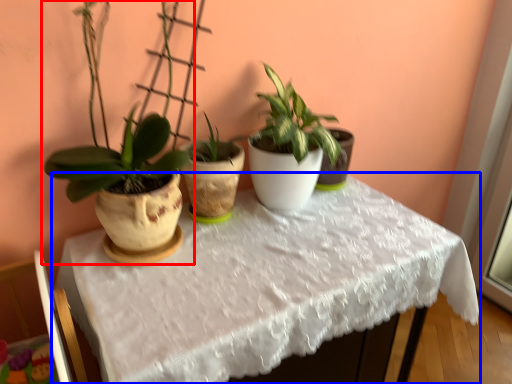
Question: Which point is closer to the camera, houseplant (highlighted by a red box) or table (highlighted by a blue box)?

Choices:
 (A) houseplant
 (B) table

Answer: (A)